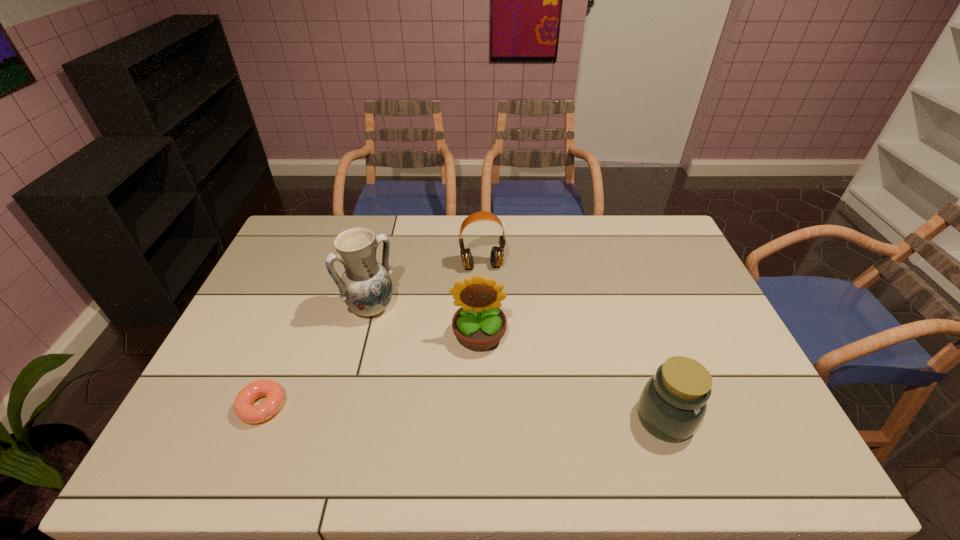
Identify the location of free space located 0.220m on either side of the fourth object from right to left. (427, 368).

Identify the location of free space located 0.110m on the face of the sunflower. (481, 392).

Locate an element on the screen. free space located 0.180m on the face of the sunflower is located at coordinates (481, 416).

I want to click on vacant point located on the face of the sunflower, so click(480, 382).

Image resolution: width=960 pixels, height=540 pixels. What are the coordinates of `vacant area located on the ear cups of the headset` in the screenshot? It's located at (495, 330).

The width and height of the screenshot is (960, 540). In order to click on vacant space located on the ear cups of the headset in this screenshot , I will do `click(494, 322)`.

This screenshot has width=960, height=540. I want to click on blank space located 0.160m on the ear cups of the headset, so click(492, 308).

At what (x,y) coordinates should I click in order to perform the action: click on doughnut that is positioned at the near edge. Please return your answer as a coordinate pair (x, y). Looking at the image, I should click on (243, 406).

At what (x,y) coordinates should I click in order to perform the action: click on jar that is at the near edge. Please return your answer as a coordinate pair (x, y). Looking at the image, I should click on (673, 402).

Identify the location of object that is positioned at the left edge. Image resolution: width=960 pixels, height=540 pixels. (243, 406).